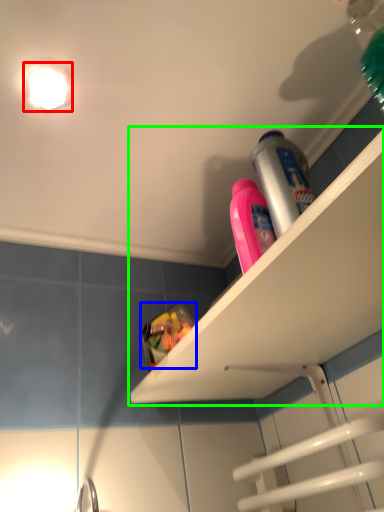
Question: Which object is the farthest from light fixture (highlighted by a red box)? Choose among these: food (highlighted by a blue box) or shelf (highlighted by a green box).

Choices:
 (A) food
 (B) shelf

Answer: (B)